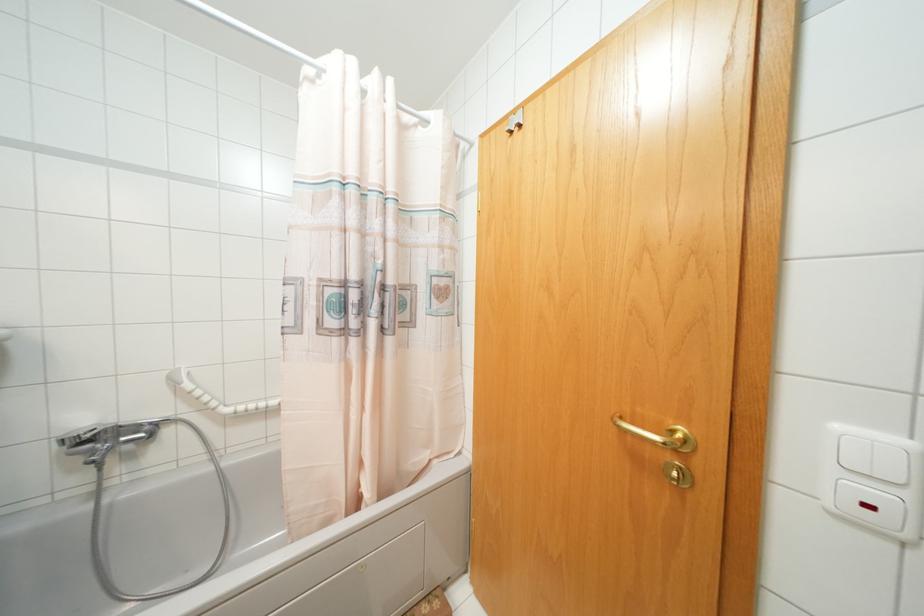
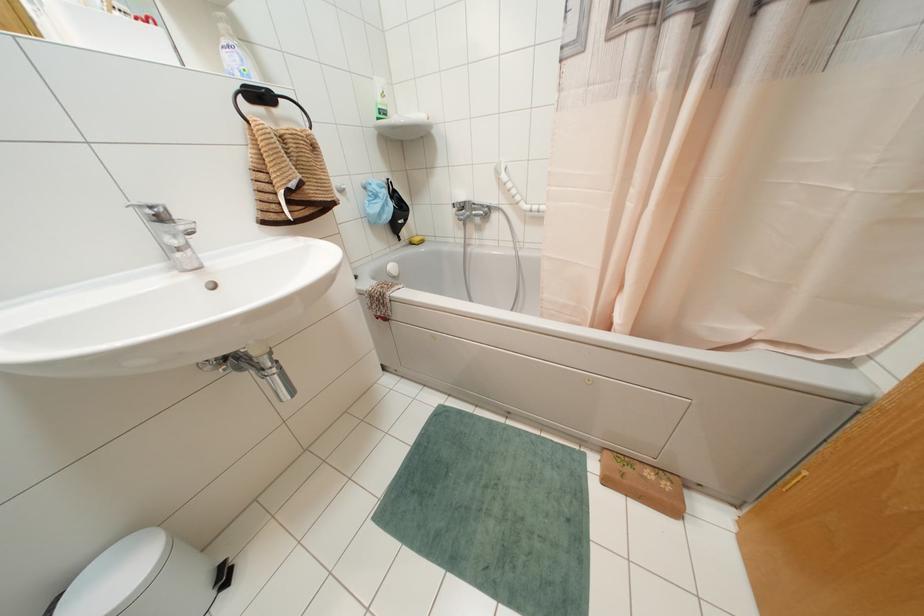
The first image is from the beginning of the video and the second image is from the end. How did the camera likely rotate when shooting the video?

The camera rotated toward left-down.